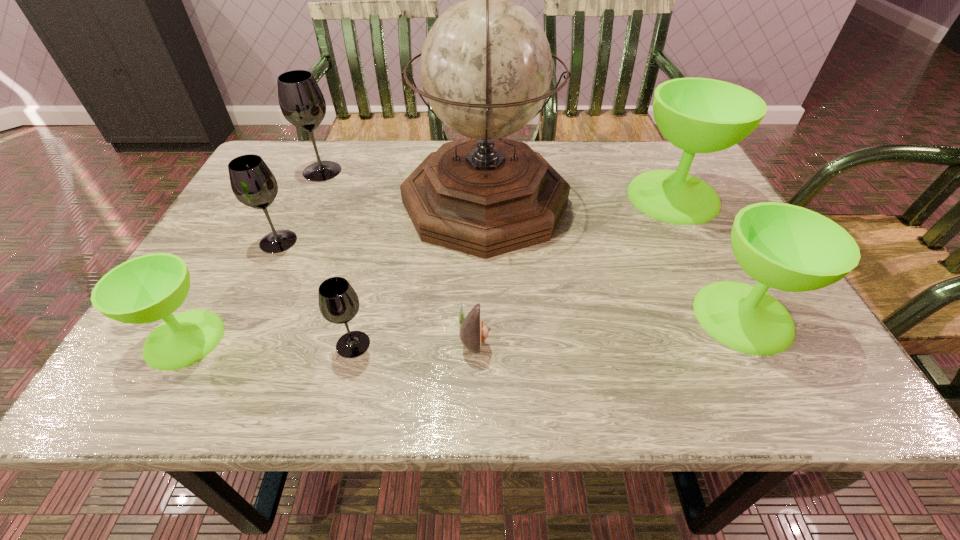
Where is `the tallest object`? the tallest object is located at coordinates (486, 66).

The height and width of the screenshot is (540, 960). In order to click on the farthest gray wineglass in this screenshot , I will do `click(301, 101)`.

I want to click on the farthest green wineglass, so click(x=698, y=115).

What are the coordinates of `the third farthest wineglass` in the screenshot? It's located at (252, 182).

In order to click on the second smallest gray wineglass in this screenshot , I will do `click(252, 182)`.

Where is `the second biggest green wineglass`? the second biggest green wineglass is located at coordinates (786, 247).

Identify the location of the leftmost green wineglass. This screenshot has height=540, width=960. (145, 289).

This screenshot has height=540, width=960. Find the location of `the smallest gray wineglass`. the smallest gray wineglass is located at coordinates (338, 302).

The width and height of the screenshot is (960, 540). In order to click on the nearest gray wineglass in this screenshot , I will do `click(338, 302)`.

This screenshot has width=960, height=540. Find the location of `the shortest object`. the shortest object is located at coordinates (473, 331).